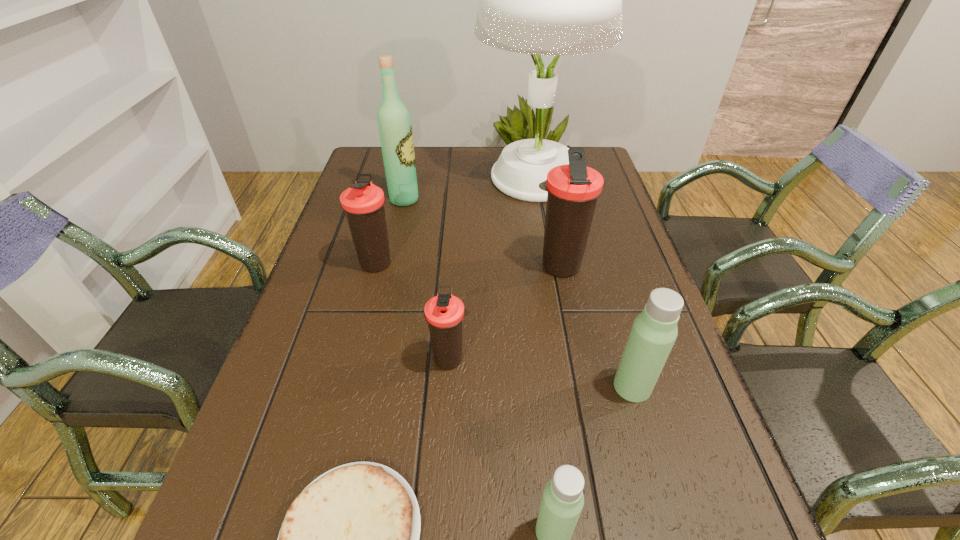
Where is `blank region between the leftmost thermos bottle and the biggest brown thermos bottle`? This screenshot has width=960, height=540. blank region between the leftmost thermos bottle and the biggest brown thermos bottle is located at coordinates (x=468, y=265).

Where is `free space between the rightmost brown thermos bottle and the smallest brown thermos bottle`? free space between the rightmost brown thermos bottle and the smallest brown thermos bottle is located at coordinates (504, 312).

You are a GUI agent. You are given a task and a screenshot of the screen. Output one action in this format:
    pyautogui.click(x=<x>, y=<y>)
    Task: Click on the vacant space that's between the sixth shortest object and the nearest brown thermos bottle
    The height and width of the screenshot is (540, 960).
    Given the screenshot: What is the action you would take?
    (x=504, y=312)

Where is `object that is the third nearest to the shortest object`? object that is the third nearest to the shortest object is located at coordinates (654, 331).

Locate an element on the screen. This screenshot has width=960, height=540. object that is the sixth closest one to the leftmost brown thermos bottle is located at coordinates (654, 331).

Identify the location of thermos bottle identified as the second closest to the smaller light thermos bottle. (444, 313).

Locate which thermos bottle is the fourth closest to the nearer light thermos bottle. Please provide its 2D coordinates. Your answer should be formatted as a tuple, i.e. [(x, y)], where the tuple contains the x and y coordinates of a point satisfying the conditions above.

[(363, 202)]

Identify which brown thermos bottle is the second nearest to the tortilla. Please provide its 2D coordinates. Your answer should be formatted as a tuple, i.e. [(x, y)], where the tuple contains the x and y coordinates of a point satisfying the conditions above.

[(363, 202)]

Where is `the closest brown thermos bottle to the smaller light thermos bottle`? Image resolution: width=960 pixels, height=540 pixels. the closest brown thermos bottle to the smaller light thermos bottle is located at coordinates (444, 313).

This screenshot has height=540, width=960. In order to click on vacant position in the image that satisfies the following two spatial constraints: 1. on the front-facing side of the right light thermos bottle; 2. on the right side of the second tallest object in this screenshot , I will do `click(363, 387)`.